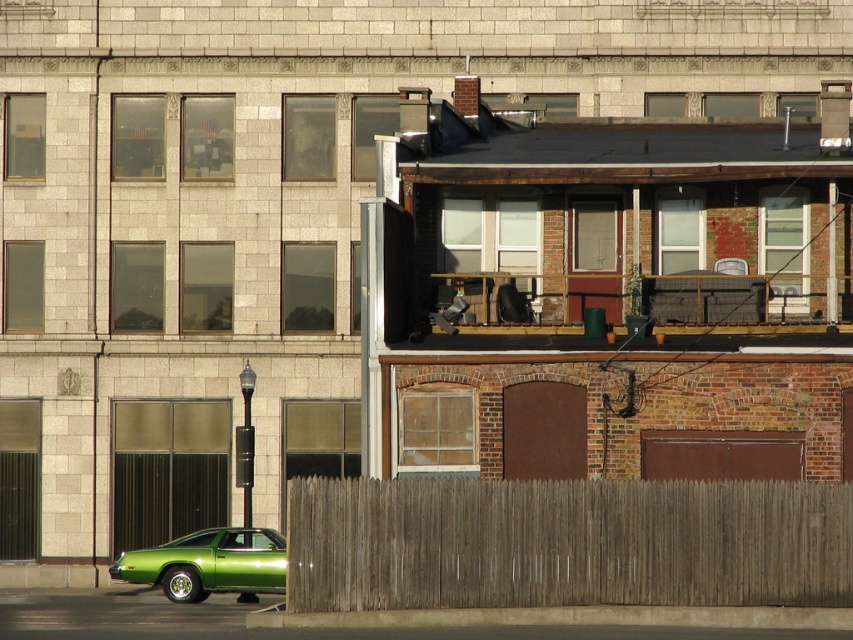
You are a delivery person trying to park your green glossy car at lower left near the brown wooden fence at lower center. Considering their heights, will the car fit under the fence without any part of it touching the fence?

The brown wooden fence at lower center is taller than the green glossy car at lower left, so the car should fit under the fence without touching it.

You are a delivery driver who needs to park your green glossy car at lower left close to the brown wooden fence at lower center. Given that the fence is larger than the car, can you park the car so that it is entirely within the area enclosed by the fence?

The brown wooden fence at lower center is larger in size than the green glossy car at lower left, so yes, the car can be parked entirely within the area enclosed by the fence since the fence is bigger.

You are a delivery person trying to find the entrance to the multi story building on the left. The brown wooden fence at lower center is in your way. Can you go around it to reach the entrance?

The brown wooden fence at lower center is located at point (566, 544). Since the entrance to the multi story building on the left is likely positioned at the lower left corner of the building, you can go around the fence by moving to the left side of the fence to reach the entrance.